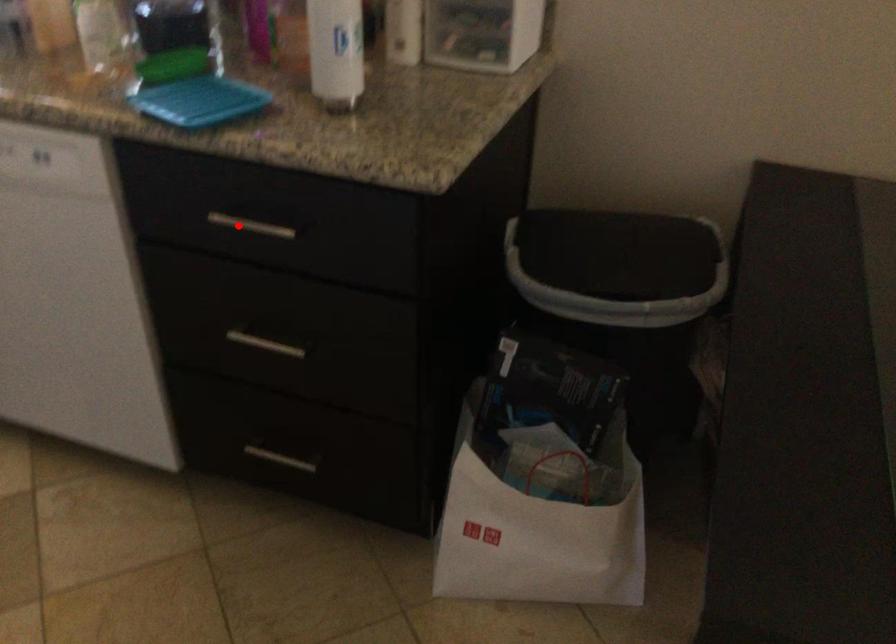
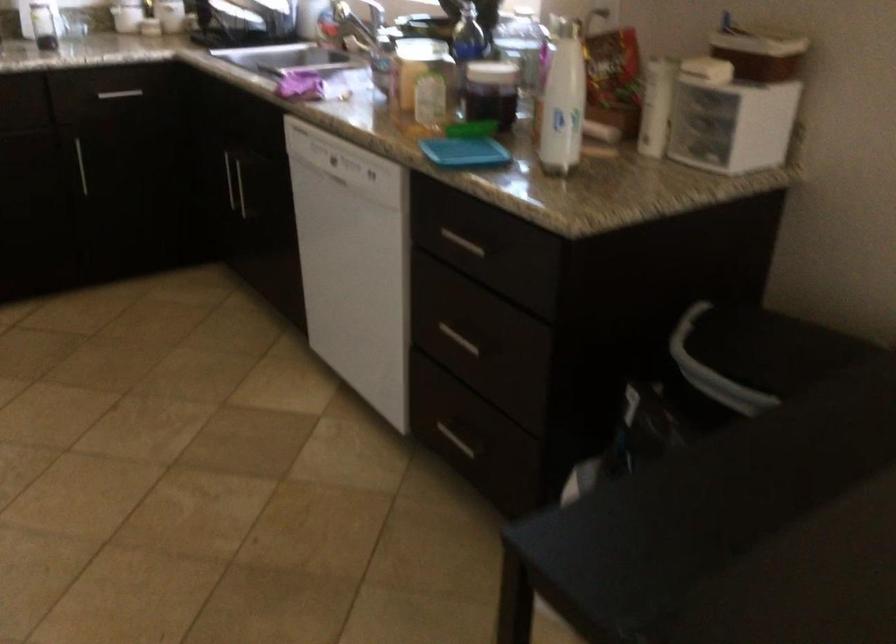
The point at the highlighted location is marked in the first image. Where is the corresponding point in the second image?

(462, 243)